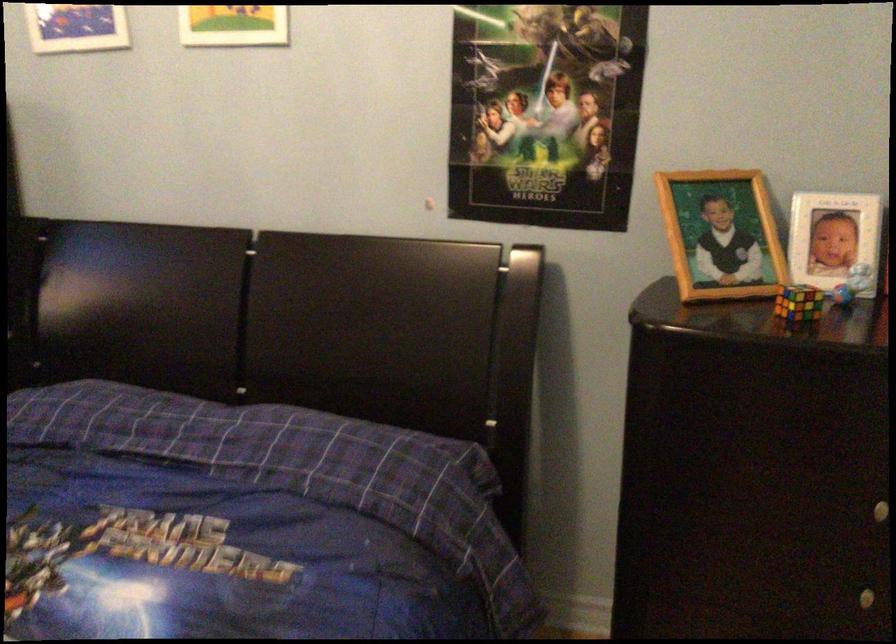
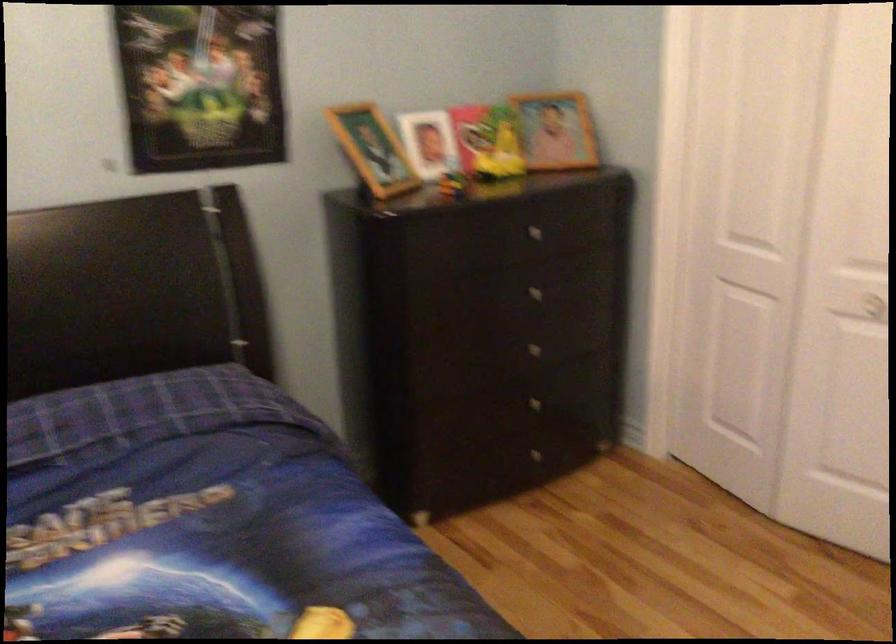
In the second image, find the point that corresponds to the point at 722,242 in the first image.

(373, 149)